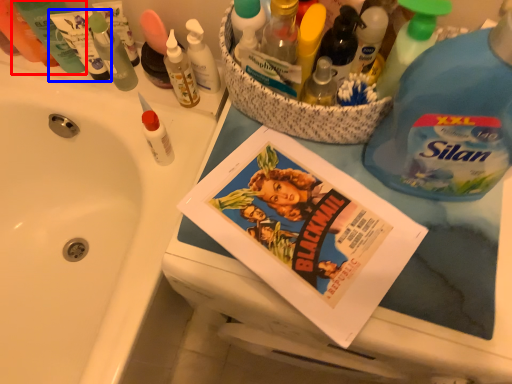
Question: Which point is closer to the camera, toiletry (highlighted by a red box) or toiletry (highlighted by a blue box)?

Choices:
 (A) toiletry
 (B) toiletry

Answer: (A)